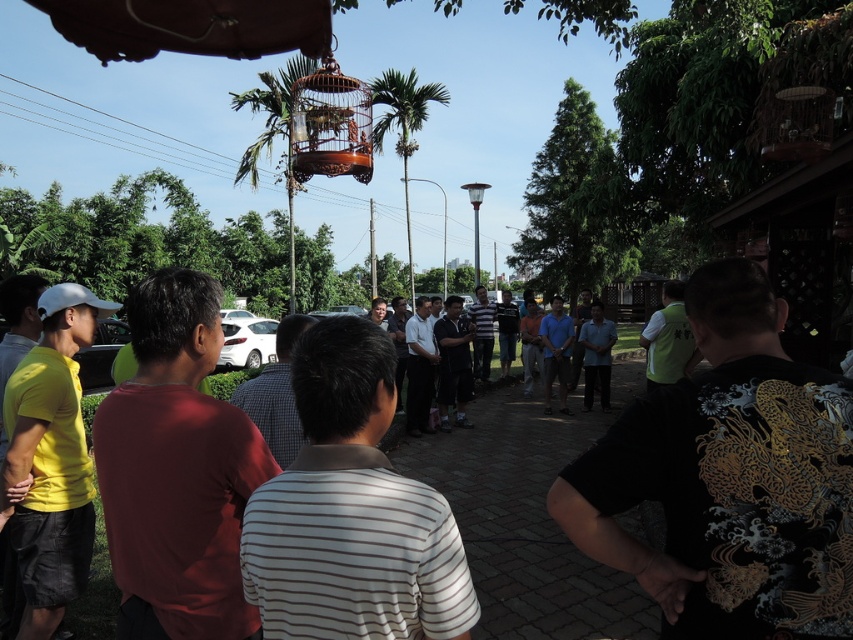
You are standing in the park and want to take a photo of the green leafy palm tree at upper center. Which direction should you face to capture it in your camera?

The green leafy palm tree at upper center is located at point upper center, so you should face towards the upper center direction to capture it in your camera.

You are a photographer trying to capture a clear photo of the wooden birdcage at center without any obstructions. Considering the green leafy palm tree at upper center, will you be able to take the photo without the palm tree blocking the birdcage?

The wooden birdcage at center is positioned under the green leafy palm tree at upper center, so the palm tree will block the birdcage in the photo.